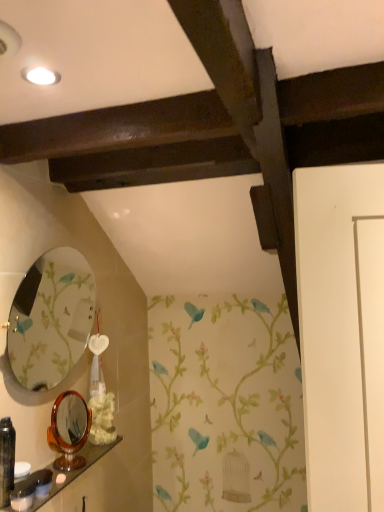
This screenshot has width=384, height=512. I want to click on wooden polished shelf at lower left, so click(76, 470).

Measure the distance between white matte flower at lower center and camera.

white matte flower at lower center and camera are 1.50 meters apart.

What do you see at coordinates (102, 419) in the screenshot?
I see `white matte flower at lower center` at bounding box center [102, 419].

Measure the distance between white glossy soap at lower left, acting as the second toiletry starting from the left, and camera.

They are 3.51 feet apart.

At what (x,y) coordinates should I click in order to perform the action: click on black plastic bottle at lower left, the 1th toiletry from the left. Please return your answer as a coordinate pair (x, y). This screenshot has height=512, width=384. Looking at the image, I should click on (6, 460).

Based on their sizes in the image, would you say matte glass mirror at left, which ranks as the 1th mirror in top-to-bottom order, is bigger or smaller than tortoiseshell mirror at lower left, the first mirror from the bottom?

matte glass mirror at left, which ranks as the 1th mirror in top-to-bottom order, is bigger than tortoiseshell mirror at lower left, the first mirror from the bottom.

Considering the relative sizes of matte glass mirror at left, which is the 2th mirror in bottom-to-top order, and tortoiseshell mirror at lower left, the 2th mirror from the top, in the image provided, is matte glass mirror at left, which is the 2th mirror in bottom-to-top order, thinner than tortoiseshell mirror at lower left, the 2th mirror from the top,?

No, matte glass mirror at left, which is the 2th mirror in bottom-to-top order, is not thinner than tortoiseshell mirror at lower left, the 2th mirror from the top.

Based on their positions, is matte glass mirror at left, which is the 2th mirror in bottom-to-top order, located to the left or right of tortoiseshell mirror at lower left, the first mirror from the bottom?

Clearly, matte glass mirror at left, which is the 2th mirror in bottom-to-top order, is on the left of tortoiseshell mirror at lower left, the first mirror from the bottom, in the image.

The height and width of the screenshot is (512, 384). What are the coordinates of `mirror above the tortoiseshell mirror at lower left, the first mirror from the bottom (from the image's perspective)` in the screenshot? It's located at (51, 318).

Is white matte flower at lower center turned away from matte black toiletry at lower left, placed as the third toiletry when sorted from left to right?

No, white matte flower at lower center is not facing away from matte black toiletry at lower left, placed as the third toiletry when sorted from left to right.

From a real-world perspective, is white matte flower at lower center positioned over matte black toiletry at lower left, the first toiletry when ordered from right to left, based on gravity?

Yes, from a real-world perspective, white matte flower at lower center is over matte black toiletry at lower left, the first toiletry when ordered from right to left

Which toiletry is the 1st one when counting from the front of the white matte flower at lower center? Please provide its 2D coordinates.

[(43, 482)]

Is white matte flower at lower center beside matte black toiletry at lower left, the first toiletry when ordered from right to left?

No.

Considering the relative sizes of white matte flower at lower center and tortoiseshell mirror at lower left, the first mirror from the bottom, in the image provided, is white matte flower at lower center thinner than tortoiseshell mirror at lower left, the first mirror from the bottom,?

Yes.

In the image, there is a tortoiseshell mirror at lower left, the 2th mirror from the top. Where is `flower below it (from a real-world perspective)`? This screenshot has height=512, width=384. flower below it (from a real-world perspective) is located at coordinates (102, 419).

From the image's perspective, is white matte flower at lower center located above tortoiseshell mirror at lower left, the first mirror from the bottom?

No, from the image's perspective, white matte flower at lower center is not on top of tortoiseshell mirror at lower left, the first mirror from the bottom.

From the picture: From a real-world perspective, is white matte flower at lower center physically above tortoiseshell mirror at lower left, the first mirror from the bottom?

No, from a real-world perspective, white matte flower at lower center is not above tortoiseshell mirror at lower left, the first mirror from the bottom.

Can you confirm if tortoiseshell mirror at lower left, the 2th mirror from the top, is taller than white glossy soap at lower left, acting as the second toiletry starting from the left?

Indeed, tortoiseshell mirror at lower left, the 2th mirror from the top, has a greater height compared to white glossy soap at lower left, acting as the second toiletry starting from the left.

From the image's perspective, is tortoiseshell mirror at lower left, the 2th mirror from the top, located above or below white glossy soap at lower left, which ranks as the second toiletry in right-to-left order?

Based on their image positions, tortoiseshell mirror at lower left, the 2th mirror from the top, is located above white glossy soap at lower left, which ranks as the second toiletry in right-to-left order.

Which is behind, tortoiseshell mirror at lower left, the 2th mirror from the top, or white glossy soap at lower left, which ranks as the second toiletry in right-to-left order?

tortoiseshell mirror at lower left, the 2th mirror from the top.

Considering the sizes of objects matte black toiletry at lower left, the first toiletry when ordered from right to left, and white glossy soap at lower left, which ranks as the second toiletry in right-to-left order, in the image provided, who is bigger, matte black toiletry at lower left, the first toiletry when ordered from right to left, or white glossy soap at lower left, which ranks as the second toiletry in right-to-left order,?

Bigger between the two is white glossy soap at lower left, which ranks as the second toiletry in right-to-left order.

Is matte black toiletry at lower left, the first toiletry when ordered from right to left, oriented away from white glossy soap at lower left, which ranks as the second toiletry in right-to-left order?

matte black toiletry at lower left, the first toiletry when ordered from right to left, is not turned away from white glossy soap at lower left, which ranks as the second toiletry in right-to-left order.

From the image's perspective, is matte black toiletry at lower left, placed as the third toiletry when sorted from left to right, over white glossy soap at lower left, which ranks as the second toiletry in right-to-left order?

No, from the image's perspective, matte black toiletry at lower left, placed as the third toiletry when sorted from left to right, is not over white glossy soap at lower left, which ranks as the second toiletry in right-to-left order.

Is matte black toiletry at lower left, the first toiletry when ordered from right to left, not near white glossy soap at lower left, acting as the second toiletry starting from the left?

They are positioned close to each other.

How different are the orientations of white matte flower at lower center and matte glass mirror at left, which is the 2th mirror in bottom-to-top order, in degrees?

44.4 degrees.

Can you confirm if white matte flower at lower center is taller than matte glass mirror at left, which is the 2th mirror in bottom-to-top order?

Incorrect, the height of white matte flower at lower center is not larger of that of matte glass mirror at left, which is the 2th mirror in bottom-to-top order.

Is white matte flower at lower center next to matte glass mirror at left, which ranks as the 1th mirror in top-to-bottom order, and touching it?

No, white matte flower at lower center is not touching matte glass mirror at left, which ranks as the 1th mirror in top-to-bottom order.

From a real-world perspective, is white matte flower at lower center positioned under matte glass mirror at left, which is the 2th mirror in bottom-to-top order, based on gravity?

Yes.

Which of these two, white matte flower at lower center or white glossy soap at lower left, acting as the second toiletry starting from the left, is wider?

white matte flower at lower center.

Could you measure the distance between white matte flower at lower center and white glossy soap at lower left, which ranks as the second toiletry in right-to-left order?

white matte flower at lower center is 14.49 inches away from white glossy soap at lower left, which ranks as the second toiletry in right-to-left order.

From the image's perspective, between white matte flower at lower center and white glossy soap at lower left, acting as the second toiletry starting from the left, who is located below?

white glossy soap at lower left, acting as the second toiletry starting from the left, appears lower in the image.

Identify the location of mirror lying behind the matte glass mirror at left, which is the 2th mirror in bottom-to-top order. [69, 430].

Locate an element on the screen. This screenshot has width=384, height=512. flower on the right of matte black toiletry at lower left, placed as the third toiletry when sorted from left to right is located at coordinates (102, 419).

Based on their spatial positions, is black plastic bottle at lower left, the 1th toiletry from the left, or white glossy soap at lower left, acting as the second toiletry starting from the left, further from matte black toiletry at lower left, the first toiletry when ordered from right to left?

black plastic bottle at lower left, the 1th toiletry from the left, is further to matte black toiletry at lower left, the first toiletry when ordered from right to left.

When comparing their distances from matte black toiletry at lower left, the first toiletry when ordered from right to left, does matte glass mirror at left, which ranks as the 1th mirror in top-to-bottom order, or tortoiseshell mirror at lower left, the 2th mirror from the top, seem closer?

tortoiseshell mirror at lower left, the 2th mirror from the top, is positioned closer to the anchor matte black toiletry at lower left, the first toiletry when ordered from right to left.

Which object lies further to the anchor point tortoiseshell mirror at lower left, the first mirror from the bottom, black plastic bottle at lower left, the 3th toiletry when ordered from right to left, or matte black toiletry at lower left, placed as the third toiletry when sorted from left to right?

The object further to tortoiseshell mirror at lower left, the first mirror from the bottom, is black plastic bottle at lower left, the 3th toiletry when ordered from right to left.

When comparing their distances from tortoiseshell mirror at lower left, the 2th mirror from the top, does matte glass mirror at left, which is the 2th mirror in bottom-to-top order, or wooden polished shelf at lower left seem further?

The object further to tortoiseshell mirror at lower left, the 2th mirror from the top, is matte glass mirror at left, which is the 2th mirror in bottom-to-top order.

Which object lies nearer to the anchor point matte black toiletry at lower left, the first toiletry when ordered from right to left, white matte flower at lower center or black plastic bottle at lower left, the 1th toiletry from the left?

Among the two, black plastic bottle at lower left, the 1th toiletry from the left, is located nearer to matte black toiletry at lower left, the first toiletry when ordered from right to left.

Based on their spatial positions, is black plastic bottle at lower left, the 1th toiletry from the left, or matte black toiletry at lower left, the first toiletry when ordered from right to left, further from white matte flower at lower center?

Based on the image, black plastic bottle at lower left, the 1th toiletry from the left, appears to be further to white matte flower at lower center.

When comparing their distances from white glossy soap at lower left, acting as the second toiletry starting from the left, does wooden polished shelf at lower left or black plastic bottle at lower left, the 3th toiletry when ordered from right to left, seem further?

Based on the image, wooden polished shelf at lower left appears to be further to white glossy soap at lower left, acting as the second toiletry starting from the left.

Consider the image. Estimate the real-world distances between objects in this image. Which object is further from matte black toiletry at lower left, the first toiletry when ordered from right to left, matte glass mirror at left, which is the 2th mirror in bottom-to-top order, or wooden polished shelf at lower left?

Based on the image, matte glass mirror at left, which is the 2th mirror in bottom-to-top order, appears to be further to matte black toiletry at lower left, the first toiletry when ordered from right to left.

This screenshot has height=512, width=384. I want to click on mirror that lies between matte glass mirror at left, which ranks as the 1th mirror in top-to-bottom order, and matte black toiletry at lower left, the first toiletry when ordered from right to left, from top to bottom, so [69, 430].

Locate an element on the screen. This screenshot has width=384, height=512. mirror between matte glass mirror at left, which ranks as the 1th mirror in top-to-bottom order, and white glossy soap at lower left, acting as the second toiletry starting from the left, in the up-down direction is located at coordinates (69, 430).

The image size is (384, 512). In order to click on shelf between black plastic bottle at lower left, the 3th toiletry when ordered from right to left, and white matte flower at lower center in the front-back direction in this screenshot , I will do `click(76, 470)`.

Locate an element on the screen. This screenshot has width=384, height=512. shelf between white glossy soap at lower left, which ranks as the second toiletry in right-to-left order, and matte black toiletry at lower left, the first toiletry when ordered from right to left, from front to back is located at coordinates (76, 470).